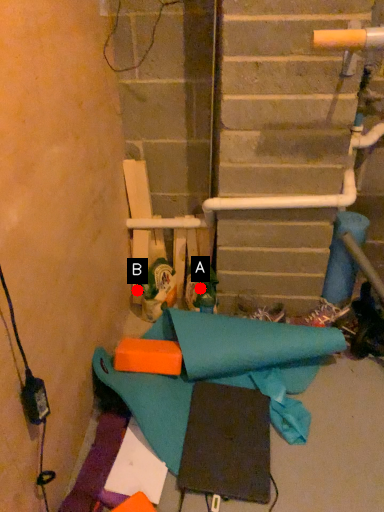
Question: Two points are circled on the image, labeled by A and B beside each circle. Which point is further to the camera?

Choices:
 (A) A is further
 (B) B is further

Answer: (B)